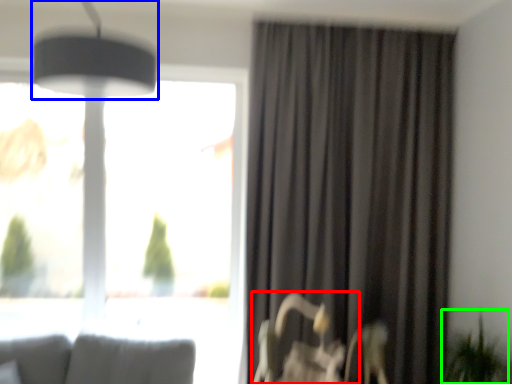
Question: Which is farther away from swivel chair (highlighted by a red box)? lamp (highlighted by a blue box) or plant (highlighted by a green box)?

Choices:
 (A) lamp
 (B) plant

Answer: (A)